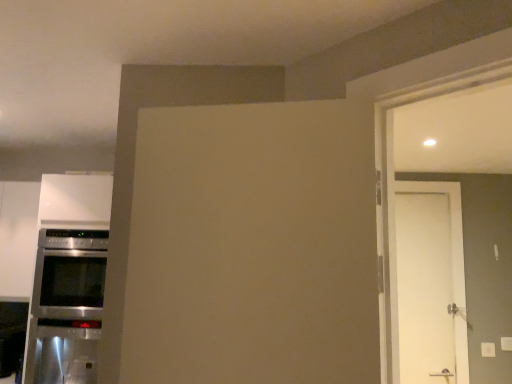
Question: Considering the relative positions of white matte door at right and stainless steel oven at left in the image provided, is white matte door at right to the right of stainless steel oven at left from the viewer's perspective?

Choices:
 (A) no
 (B) yes

Answer: (B)

Question: Can you confirm if white matte door at right is shorter than stainless steel oven at left?

Choices:
 (A) no
 (B) yes

Answer: (A)

Question: Does white matte door at right come in front of stainless steel oven at left?

Choices:
 (A) no
 (B) yes

Answer: (A)

Question: Is white matte door at right completely or partially outside of stainless steel oven at left?

Choices:
 (A) no
 (B) yes

Answer: (B)

Question: From the image's perspective, would you say white matte door at right is positioned over stainless steel oven at left?

Choices:
 (A) no
 (B) yes

Answer: (B)

Question: Does white matte door at right have a smaller size compared to stainless steel oven at left?

Choices:
 (A) yes
 (B) no

Answer: (A)

Question: From a real-world perspective, is stainless steel oven at left located higher than white matte door at right?

Choices:
 (A) yes
 (B) no

Answer: (B)

Question: Is stainless steel oven at left located outside white matte door at right?

Choices:
 (A) yes
 (B) no

Answer: (A)

Question: Is stainless steel oven at left in front of white matte door at right?

Choices:
 (A) no
 (B) yes

Answer: (B)

Question: Is white matte door at right inside stainless steel oven at left?

Choices:
 (A) no
 (B) yes

Answer: (A)

Question: Does stainless steel oven at left turn towards white matte door at right?

Choices:
 (A) yes
 (B) no

Answer: (B)

Question: Is stainless steel oven at left touching white matte door at right?

Choices:
 (A) no
 (B) yes

Answer: (A)

Question: From the image's perspective, is white matte door at right located above or below stainless steel oven at left?

Choices:
 (A) below
 (B) above

Answer: (B)